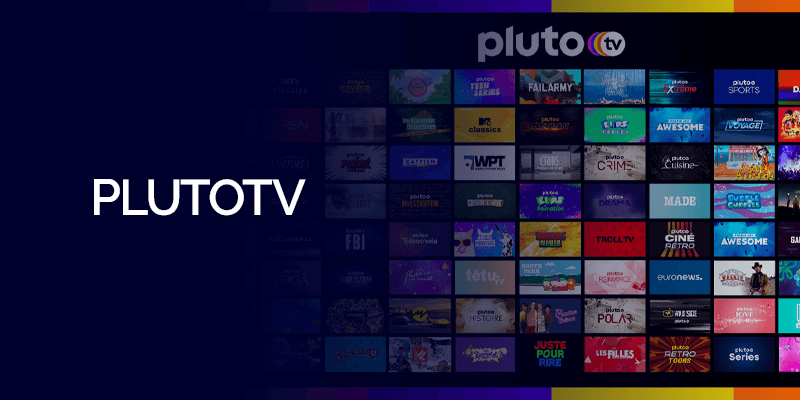
Identify the location of purple trim. (488, 11).